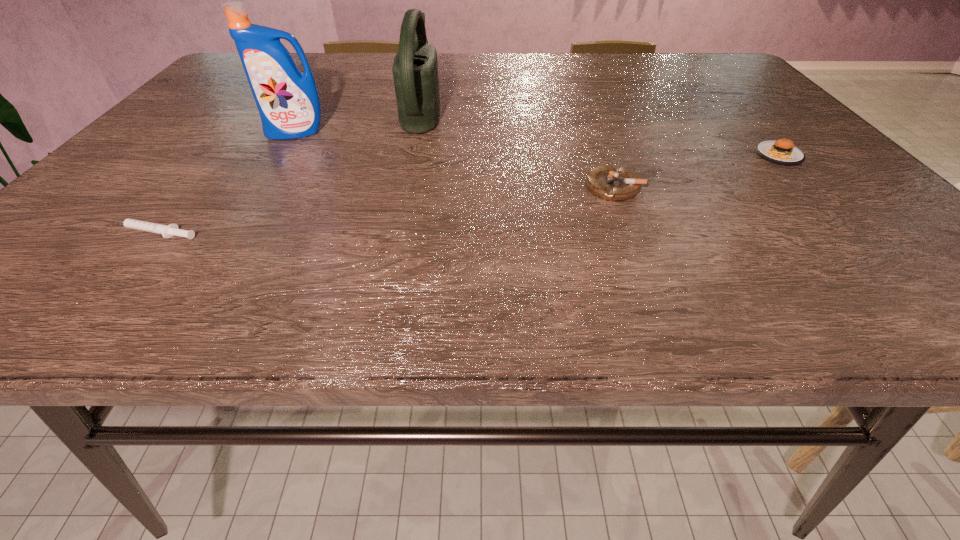
The width and height of the screenshot is (960, 540). In order to click on vacant region located on the front of the rightmost object in this screenshot , I will do `click(808, 187)`.

This screenshot has height=540, width=960. Identify the location of free space located on the back of the ashtray. (585, 109).

The image size is (960, 540). Find the location of `free space located on the back of the nearest object`. free space located on the back of the nearest object is located at coordinates (218, 151).

Where is `object that is at the far edge`? The image size is (960, 540). object that is at the far edge is located at coordinates (415, 68).

This screenshot has height=540, width=960. Identify the location of object present at the left edge. (167, 231).

The width and height of the screenshot is (960, 540). Find the location of `object situated at the right edge`. object situated at the right edge is located at coordinates (782, 152).

Image resolution: width=960 pixels, height=540 pixels. In the image, there is a desktop. What are the coordinates of `free space at the far edge` in the screenshot? It's located at (605, 52).

You are a GUI agent. You are given a task and a screenshot of the screen. Output one action in this format:
    pyautogui.click(x=<x>, y=<y>)
    Task: Click on the free space at the near edge of the desktop
    This screenshot has width=960, height=540.
    Given the screenshot: What is the action you would take?
    pyautogui.click(x=563, y=302)

In the image, there is a desktop. Where is `vacant space at the left edge`? The image size is (960, 540). vacant space at the left edge is located at coordinates (205, 90).

Locate an element on the screen. vacant space at the right edge is located at coordinates (816, 193).